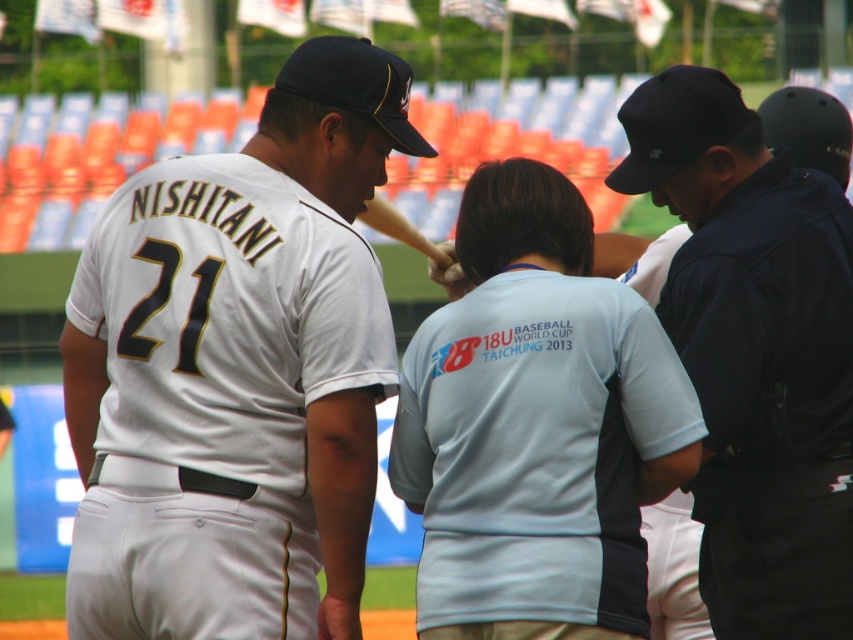
You are a photographer standing at the edge of the baseball field. You want to take a photo of the white jersey at center and the light blue fabric shirt at center. If your camera has a maximum focus range of 5 feet, will both subjects be in focus?

The white jersey at center is 5.38 feet away from the light blue fabric shirt at center. Since the distance between them is greater than the camera maximum focus range of 5 feet, the camera cannot focus on both subjects simultaneously.

You are a photographer positioned at the center of the baseball stadium. You need to take a photo of the white jersey at center. Where should you aim your camera to capture it?

The white jersey at center is located at point [242,360], so you should aim your camera at those coordinates to capture it.

From the picture: You are a photographer at the baseball stadium and want to take a photo of the white jersey at center and the dark blue uniform at center. Which one should you zoom in more on to capture details clearly?

The white jersey at center has a smaller size compared to dark blue uniform at center, so you should zoom in more on the white jersey at center to capture its details clearly.